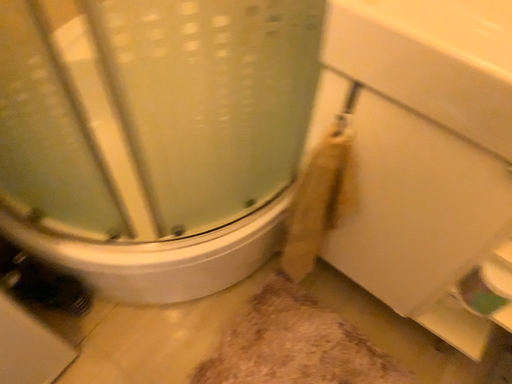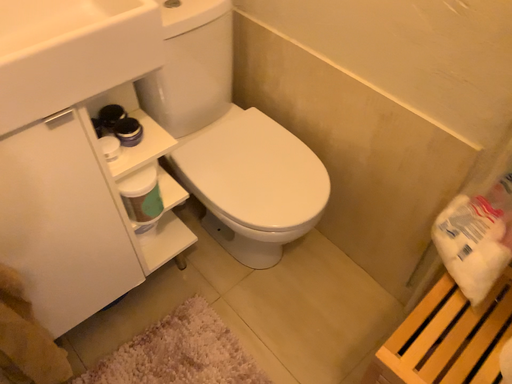
Question: Which way did the camera rotate in the video?

Choices:
 (A) rotated downward
 (B) rotated upward

Answer: (B)